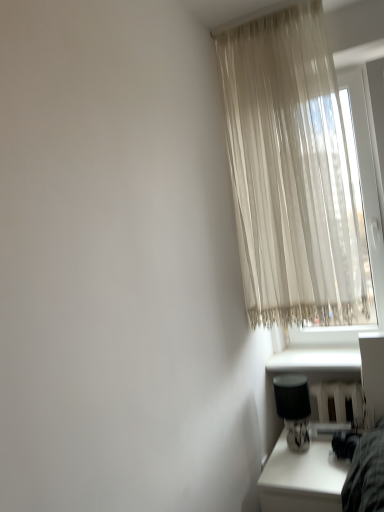
Locate an element on the screen. free space above sheer beige curtain at upper right (from a real-world perspective) is located at coordinates (272, 9).